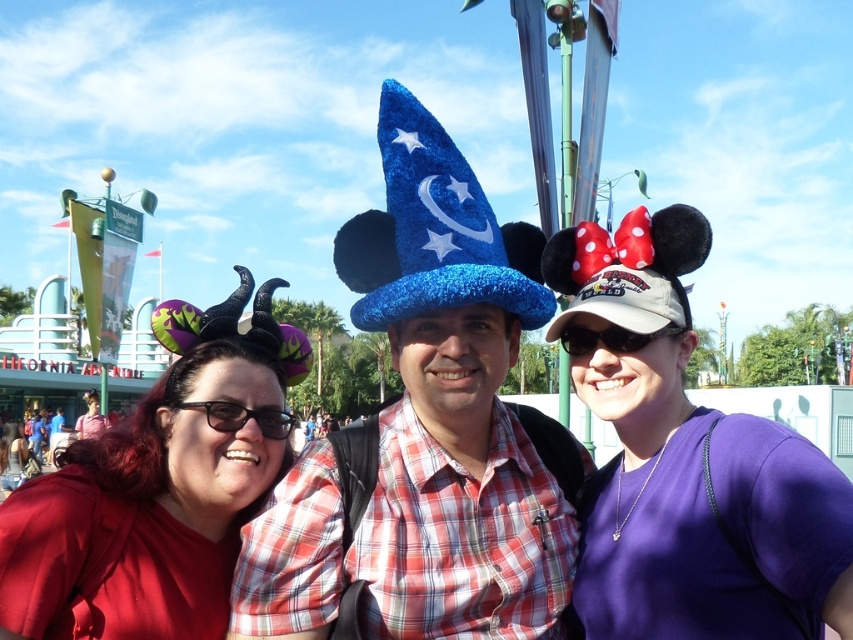
Question: Can you confirm if shiny blue wizard hat at center is positioned to the left of matte red shirt at center?

Choices:
 (A) yes
 (B) no

Answer: (B)

Question: Which point is closer to the camera taking this photo?

Choices:
 (A) click(68, 540)
 (B) click(614, 349)
 (C) click(273, 424)

Answer: (A)

Question: Which is farther from the purple fabric minnie mouse hat at right?

Choices:
 (A) matte red shirt at center
 (B) black plastic sunglasses at center

Answer: (A)

Question: Does matte red shirt at center have a greater width compared to black plastic goggles at center?

Choices:
 (A) no
 (B) yes

Answer: (B)

Question: Which point appears closest to the camera in this image?

Choices:
 (A) [599, 314]
 (B) [271, 410]
 (C) [575, 353]
 (D) [16, 451]

Answer: (A)

Question: Is shiny blue wizard hat at center below matte red shirt at center?

Choices:
 (A) yes
 (B) no

Answer: (B)